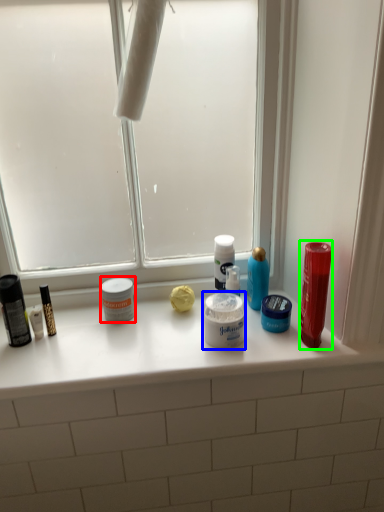
Question: Which is farther away from toiletry (highlighted by a red box)? cream (highlighted by a blue box) or mouthwash (highlighted by a green box)?

Choices:
 (A) cream
 (B) mouthwash

Answer: (B)